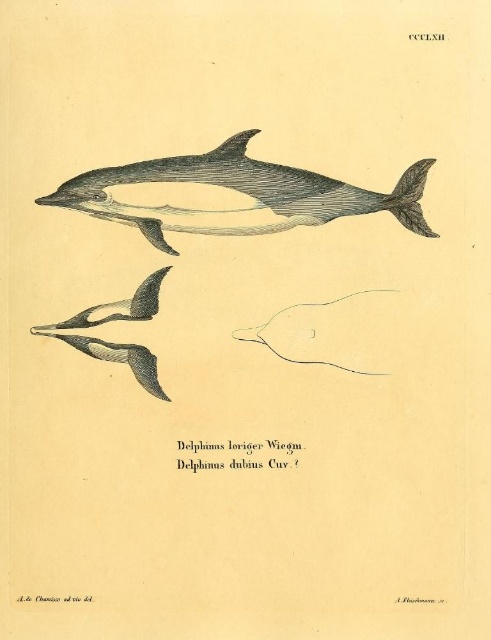
Question: Considering the relative positions of gray ink dolphin at center and gray textured dolphin at lower left in the image provided, where is gray ink dolphin at center located with respect to gray textured dolphin at lower left?

Choices:
 (A) below
 (B) above

Answer: (B)

Question: Can you confirm if gray ink dolphin at center is thinner than gray matte dolphin fin at lower left?

Choices:
 (A) no
 (B) yes

Answer: (A)

Question: Among these objects, which one is nearest to the camera?

Choices:
 (A) gray textured dolphin at lower left
 (B) gray matte dolphin fin at lower left

Answer: (B)

Question: Based on their relative distances, which object is farther from the gray textured dolphin at lower left?

Choices:
 (A) gray matte dolphin fin at lower left
 (B) gray ink dolphin at center

Answer: (B)

Question: Does gray textured dolphin at lower left appear on the right side of gray matte dolphin fin at lower left?

Choices:
 (A) no
 (B) yes

Answer: (B)

Question: Which point appears farthest from the camera in this image?

Choices:
 (A) (317, 180)
 (B) (66, 333)

Answer: (A)